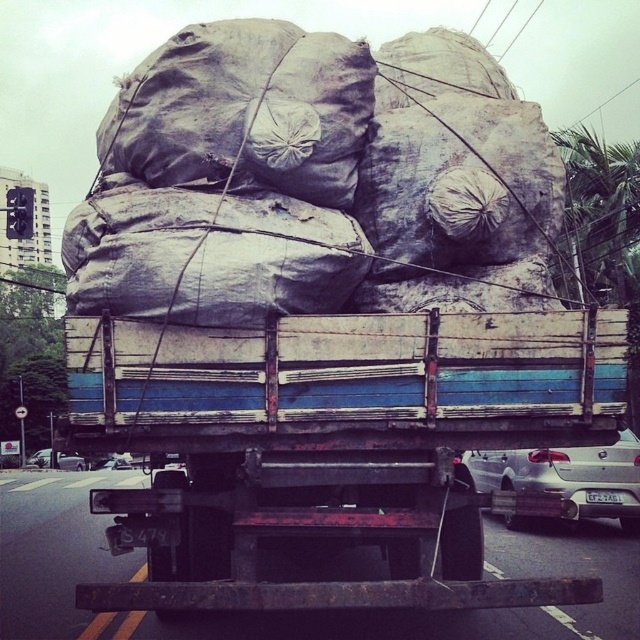
Question: Among these objects, which one is farthest from the camera?

Choices:
 (A) silver metallic sedan at lower left
 (B) rusty metal trailer truck at center
 (C) silver metallic car at lower right

Answer: (C)

Question: Which point is farther to the camera?

Choices:
 (A) silver metallic car at lower right
 (B) rusty metal trailer truck at center
 (C) silver metallic sedan at lower left

Answer: (A)

Question: In this image, where is rusty metal trailer truck at center located relative to silver metallic sedan at lower left?

Choices:
 (A) left
 (B) right

Answer: (B)

Question: Where is rusty metal trailer truck at center located in relation to silver metallic car at lower right in the image?

Choices:
 (A) right
 (B) left

Answer: (B)

Question: Which object appears farthest from the camera in this image?

Choices:
 (A) silver metallic car at lower right
 (B) rusty metal trailer truck at center

Answer: (A)

Question: Is rusty metal trailer truck at center to the left of silver metallic sedan at lower left from the viewer's perspective?

Choices:
 (A) yes
 (B) no

Answer: (B)